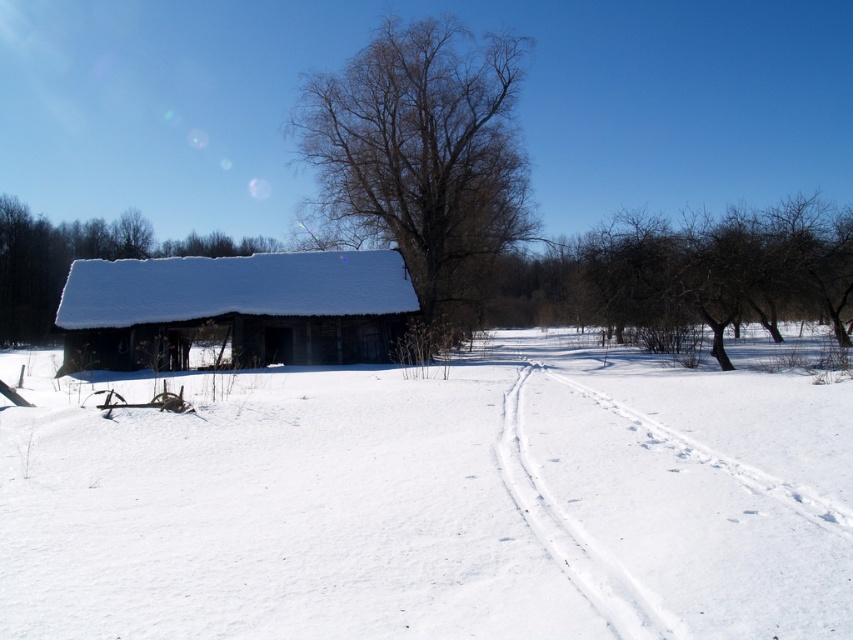
Who is positioned more to the left, bare wood tree at center or snow-covered wooden barn at center?

snow-covered wooden barn at center

Does bare wood tree at center have a greater height compared to snow-covered wooden barn at center?

Yes, bare wood tree at center is taller than snow-covered wooden barn at center.

Is point (339, 138) behind point (97, 346)?

That is True.

Find the location of `bare wood tree at center`. bare wood tree at center is located at coordinates (422, 152).

Between white fluffy snow at center and white snow track at lower right, which one appears on the right side from the viewer's perspective?

white snow track at lower right

Is white fluffy snow at center to the left of white snow track at lower right from the viewer's perspective?

Yes, white fluffy snow at center is to the left of white snow track at lower right.

Identify the location of white fluffy snow at center. The height and width of the screenshot is (640, 853). (436, 500).

Is the position of white snow track at lower right more distant than that of snow-covered wooden shed at left?

No, it is in front of snow-covered wooden shed at left.

Is white snow track at lower right shorter than snow-covered wooden shed at left?

Correct, white snow track at lower right is not as tall as snow-covered wooden shed at left.

What do you see at coordinates (669, 522) in the screenshot? The width and height of the screenshot is (853, 640). I see `white snow track at lower right` at bounding box center [669, 522].

Where is `white snow track at lower right`? The image size is (853, 640). white snow track at lower right is located at coordinates [669, 522].